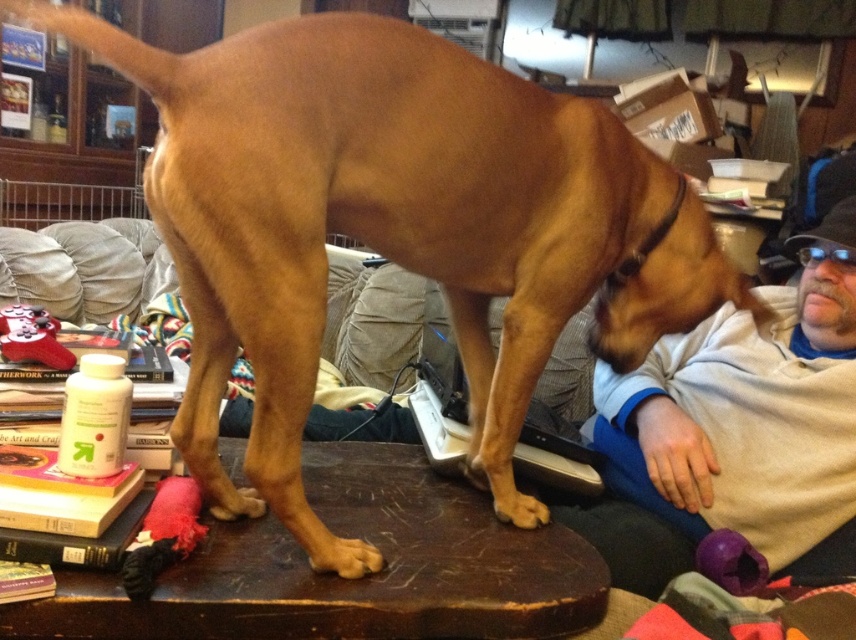
Question: Is brown rough fur paw at lower center above brown matte paw at lower center?

Choices:
 (A) yes
 (B) no

Answer: (B)

Question: Which is farther from the brown matte paw at lower center?

Choices:
 (A) brown rough fur paw at lower center
 (B) red plush stocking at upper left
 (C) brown wooden table at center
 (D) golden fur paw at lower center

Answer: (D)

Question: Which object is closer to the camera taking this photo?

Choices:
 (A) brown matte paw at lower center
 (B) brown wooden table at center

Answer: (B)

Question: Can you confirm if brown wooden table at center is positioned below red plush stocking at upper left?

Choices:
 (A) yes
 (B) no

Answer: (A)

Question: Is brown rough fur paw at lower center bigger than brown matte paw at lower center?

Choices:
 (A) yes
 (B) no

Answer: (B)

Question: Which point is farther to the camera?

Choices:
 (A) (58, 349)
 (B) (278, 600)
 (C) (223, 502)

Answer: (A)